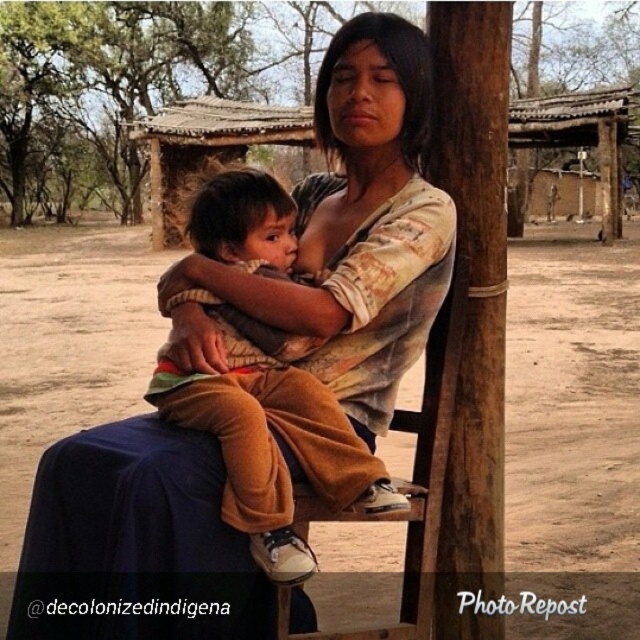
Which is more to the left, brown velvety pants at center or wooden chair at center?

brown velvety pants at center is more to the left.

Does brown velvety pants at center have a greater width compared to wooden chair at center?

Yes, brown velvety pants at center is wider than wooden chair at center.

Does point (312, 385) lie behind point (300, 632)?

No.

I want to click on brown velvety pants at center, so click(x=273, y=442).

Who is more forward, (122, 140) or (349, 481)?

Positioned in front is point (349, 481).

Who is positioned more to the right, green leafy tree at upper left or brown velvety pants at center?

brown velvety pants at center

What are the coordinates of `green leafy tree at upper left` in the screenshot? It's located at (116, 88).

Can you confirm if distressed cotton shirt at center is bigger than wooden chair at center?

Yes, distressed cotton shirt at center is bigger than wooden chair at center.

Does distressed cotton shirt at center appear over wooden chair at center?

Indeed, distressed cotton shirt at center is positioned over wooden chair at center.

Measure the distance between distressed cotton shirt at center and camera.

distressed cotton shirt at center is 1.66 meters from camera.

Where is `distressed cotton shirt at center`? distressed cotton shirt at center is located at coordinates (348, 234).